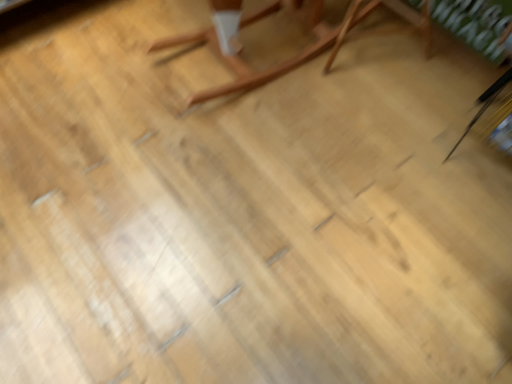
What are the coordinates of `vacant space in front of light brown wood rocking chair at center` in the screenshot? It's located at (242, 170).